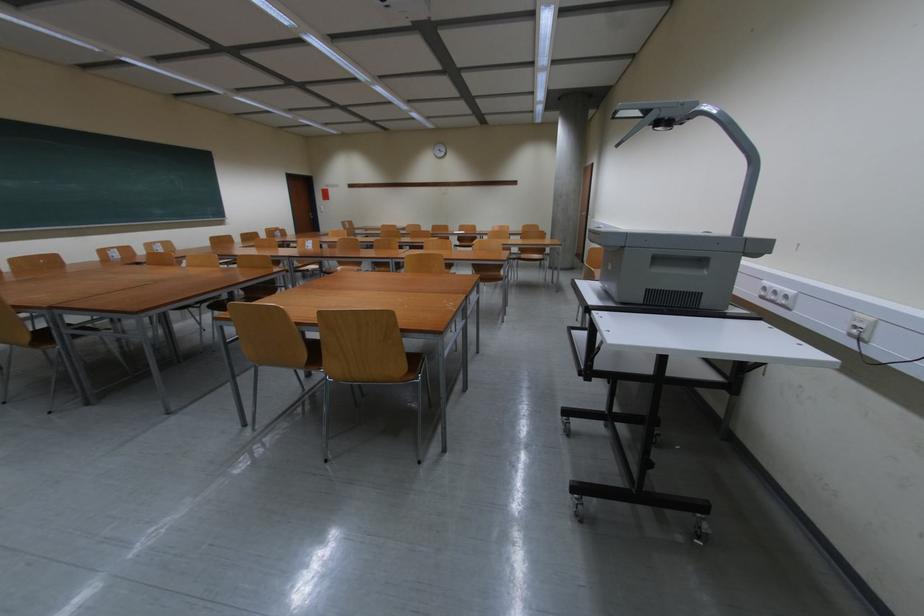
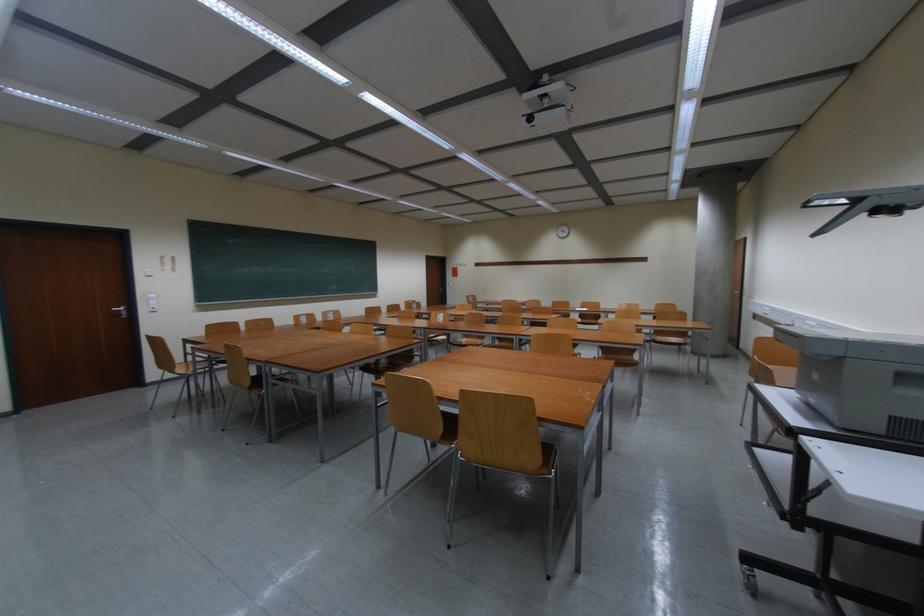
In a continuous first-person perspective shot, in which direction is the camera moving?

The cameraman moved toward left, backward.